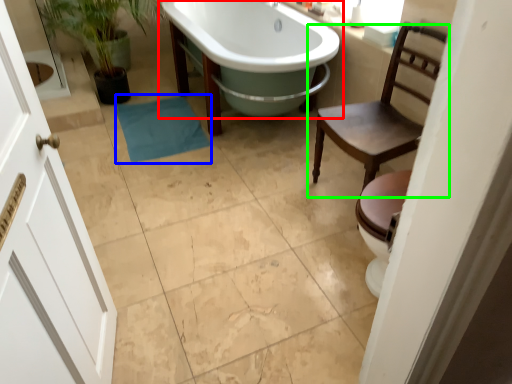
Question: Which object is positioned closest to bathtub (highlighted by a red box)? Select from bath towel (highlighted by a blue box) and chair (highlighted by a green box).

Choices:
 (A) bath towel
 (B) chair

Answer: (A)